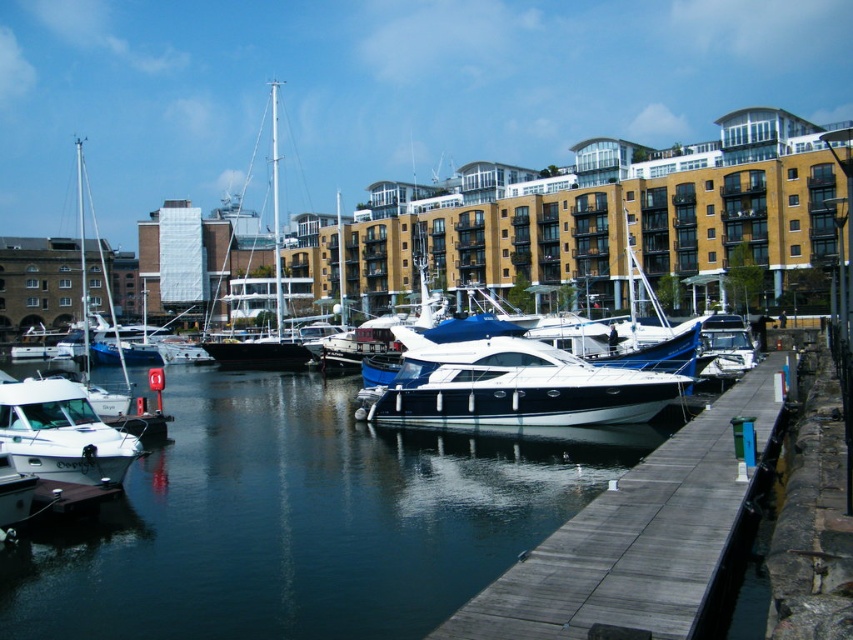
Question: Does glossy water at center appear over white glossy motorboat at center?

Choices:
 (A) yes
 (B) no

Answer: (B)

Question: Does wooden at center come in front of shiny white sailboat at center?

Choices:
 (A) yes
 (B) no

Answer: (A)

Question: Which object appears farthest from the camera in this image?

Choices:
 (A) white glossy boat at lower left
 (B) wooden at center
 (C) white glossy motorboat at center
 (D) glossy water at center

Answer: (C)

Question: Which point is closer to the camera?

Choices:
 (A) (270, 96)
 (B) (262, 634)
 (C) (434, 337)

Answer: (B)

Question: Is glossy water at center smaller than shiny white sailboat at center?

Choices:
 (A) no
 (B) yes

Answer: (B)

Question: Which of the following is the closest to the observer?

Choices:
 (A) wooden at center
 (B) shiny white sailboat at center
 (C) white glossy motorboat at center

Answer: (A)